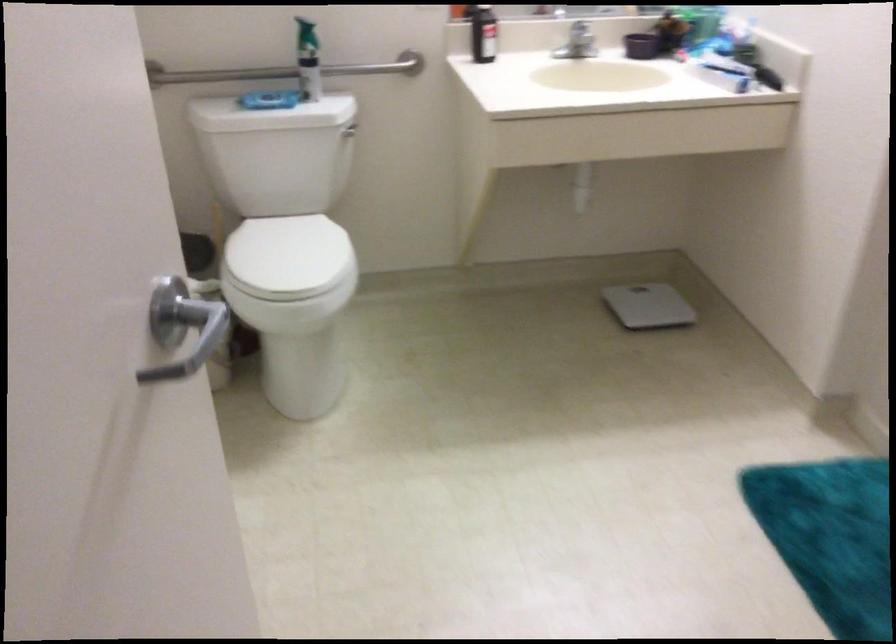
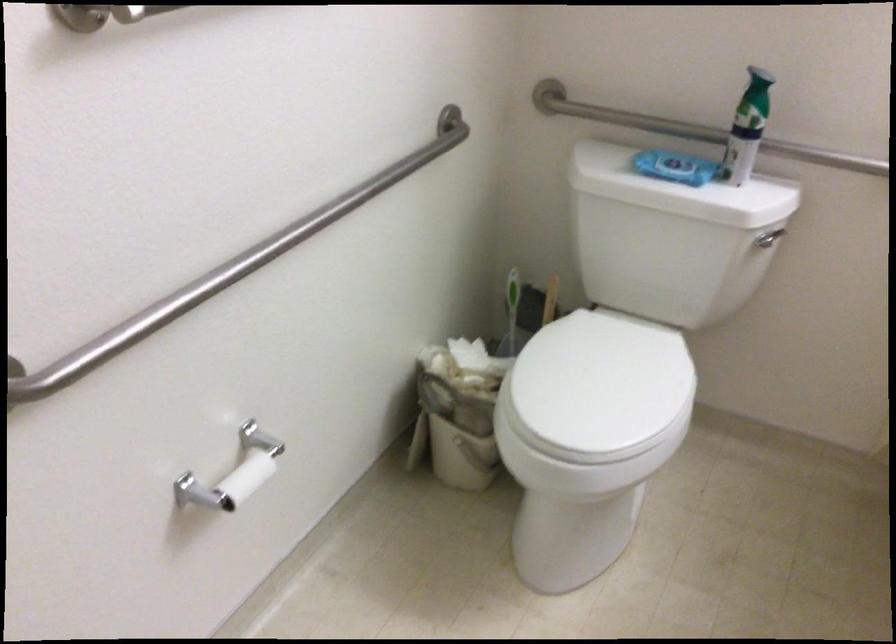
Locate, in the second image, the point that corresponds to (x=298, y=254) in the first image.

(600, 384)